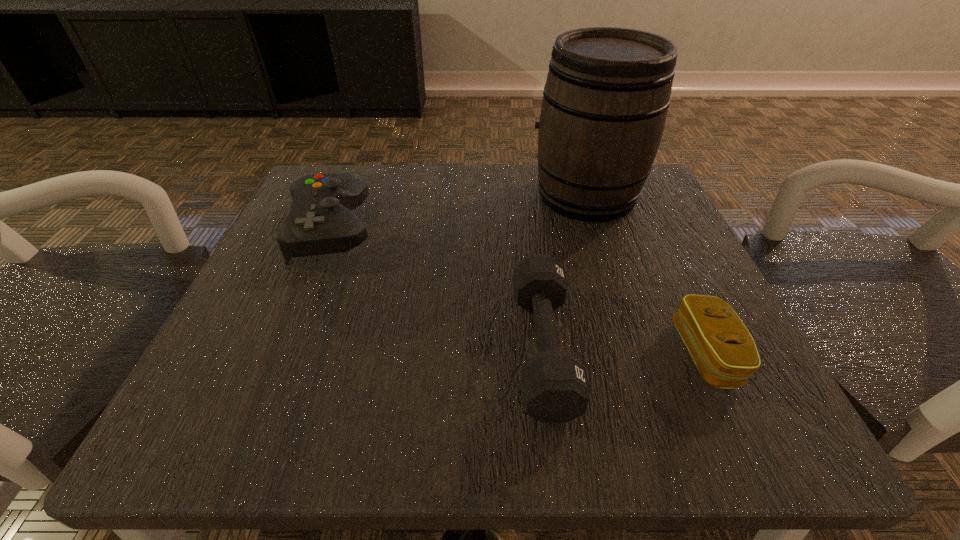
Locate an element on the screen. The width and height of the screenshot is (960, 540). wine bucket at the far edge is located at coordinates (605, 101).

The height and width of the screenshot is (540, 960). Identify the location of control located in the far edge section of the desktop. (x=320, y=221).

Identify the location of dumbbell at the near edge. (555, 388).

This screenshot has width=960, height=540. I want to click on clutch bag that is at the near edge, so click(725, 354).

This screenshot has width=960, height=540. I want to click on object that is at the left edge, so click(x=320, y=221).

You are a GUI agent. You are given a task and a screenshot of the screen. Output one action in this format:
    pyautogui.click(x=<x>, y=<y>)
    Task: Click on the wine bucket present at the right edge
    
    Given the screenshot: What is the action you would take?
    pyautogui.click(x=605, y=101)

Find the location of `clutch bag at the right edge`. clutch bag at the right edge is located at coordinates (725, 354).

The image size is (960, 540). In order to click on object located in the far left corner section of the desktop in this screenshot , I will do point(320,221).

The width and height of the screenshot is (960, 540). I want to click on object present at the far right corner, so click(x=605, y=101).

Identify the location of object that is at the near right corner. This screenshot has width=960, height=540. (725, 354).